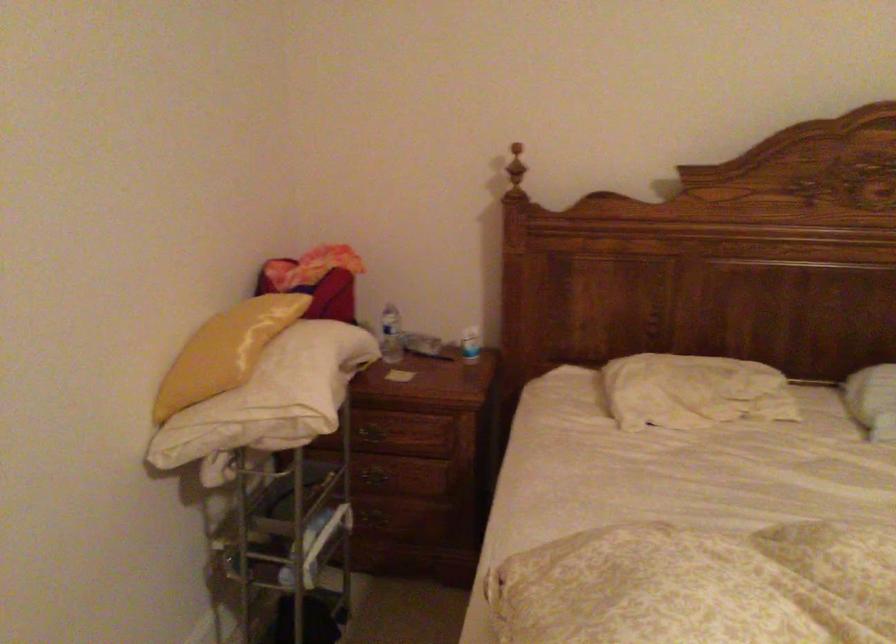
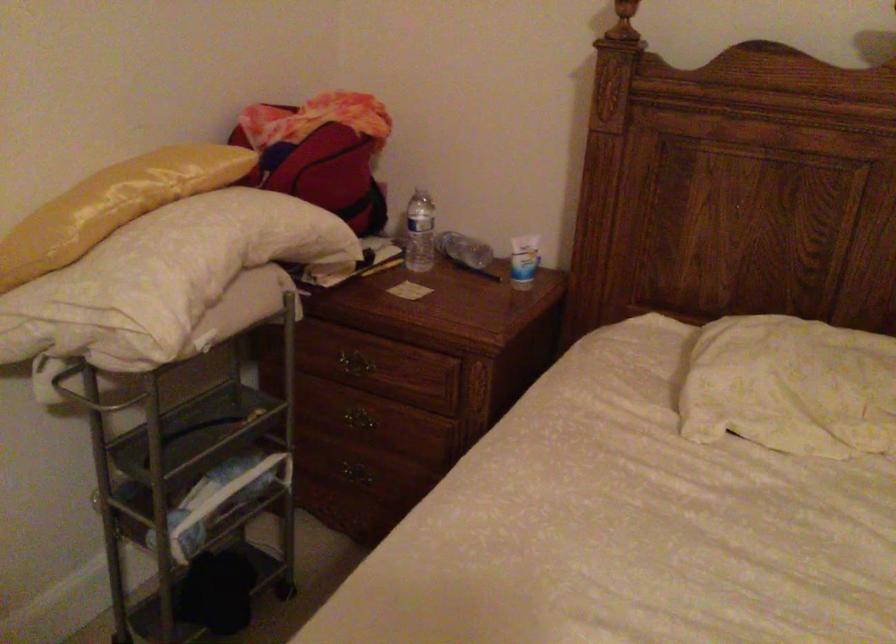
Locate, in the second image, the point that corresponds to [375,483] in the first image.

(357, 426)